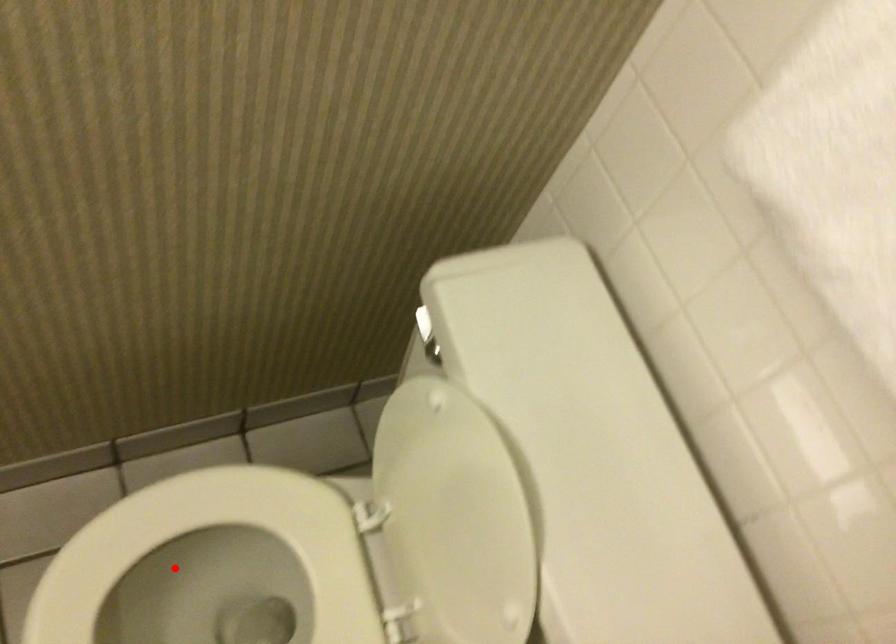
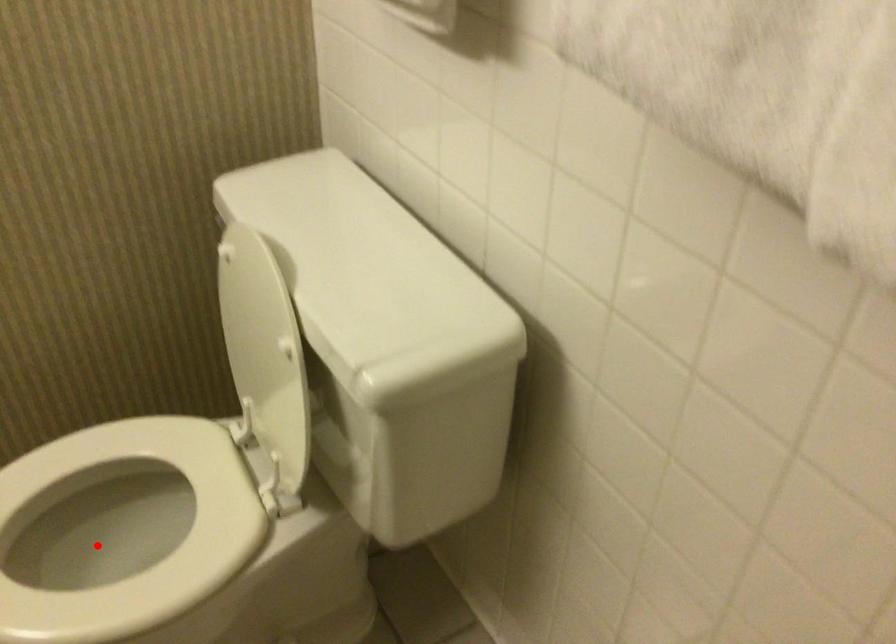
I am providing you with two images of the same scene from different viewpoints. A red point is marked on the first image and another point is marked on the second image. Does the point marked in image1 correspond to the same location as the one in image2?

Yes